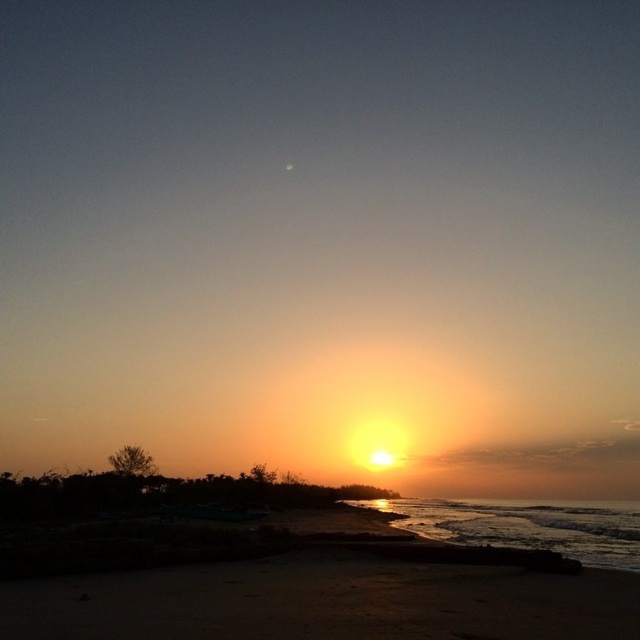
You are standing on the sandy beach at lower center and want to reach the shiny metallic water at lower right. Which direction should you move to get there?

You should move downward because the shiny metallic water at lower right is located below the sandy beach at lower center.

You are a drone operator trying to capture the sunset over the beach. Your drone is currently at the coordinates where the sun is located. To frame the sandy beach at lower center in your shot, should you move your drone north or south? Please explain your reasoning based on the scene description.

The sandy beach at lower center is located at coordinates point (x=365, y=586). Since the sun is at the horizon near the top of the image, the drone is likely positioned north of the sandy beach. To frame the sandy beach at lower center, the drone should move south to align with the lower part of the image where the beach is situated.